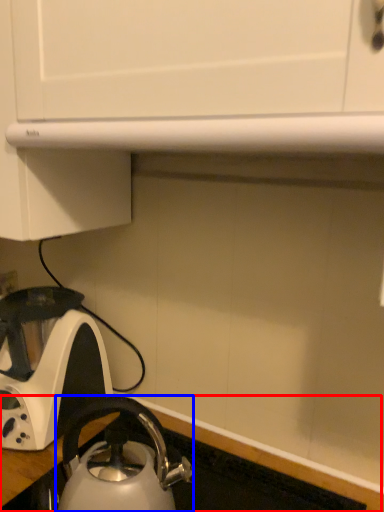
Question: Which object appears closest to the camera in this image, counter top (highlighted by a red box) or kettle (highlighted by a blue box)?

Choices:
 (A) counter top
 (B) kettle

Answer: (A)